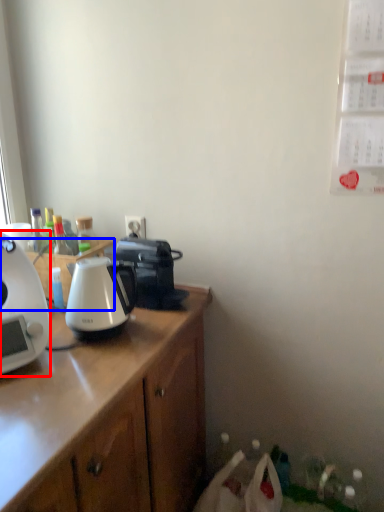
Question: Which point is closer to the camera, coffee maker (highlighted by a red box) or desk (highlighted by a blue box)?

Choices:
 (A) coffee maker
 (B) desk

Answer: (A)